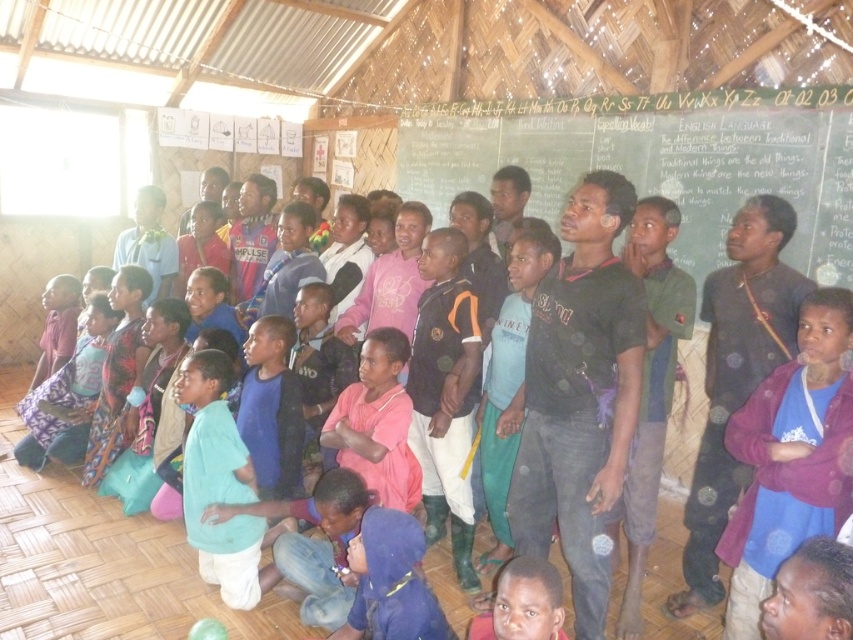
Based on the photo, who is higher up, green chalkboard at upper center or pink fabric at center?

green chalkboard at upper center is above.

Between green chalkboard at upper center and pink fabric at center, which one appears on the left side from the viewer's perspective?

Positioned to the left is pink fabric at center.

Which is behind, point (821, 257) or point (16, 497)?

The point (16, 497) is behind.

You are a GUI agent. You are given a task and a screenshot of the screen. Output one action in this format:
    pyautogui.click(x=<x>, y=<y>)
    Task: Click on the green chalkboard at upper center
    The width and height of the screenshot is (853, 640).
    Given the screenshot: What is the action you would take?
    pyautogui.click(x=657, y=161)

Which of these two, pink fabric at center or black matte shirt at center, stands shorter?

pink fabric at center is shorter.

Is point (152, 616) closer to camera compared to point (572, 408)?

No.

The image size is (853, 640). I want to click on pink fabric at center, so click(x=105, y=570).

Who is taller, green chalkboard at upper center or black matte shirt at center?

With more height is black matte shirt at center.

Is green chalkboard at upper center further to camera compared to black matte shirt at center?

Yes, it is behind black matte shirt at center.

Is point (682, 230) farther from camera compared to point (563, 260)?

Yes, point (682, 230) is farther from viewer.

Locate an element on the screen. green chalkboard at upper center is located at coordinates (657, 161).